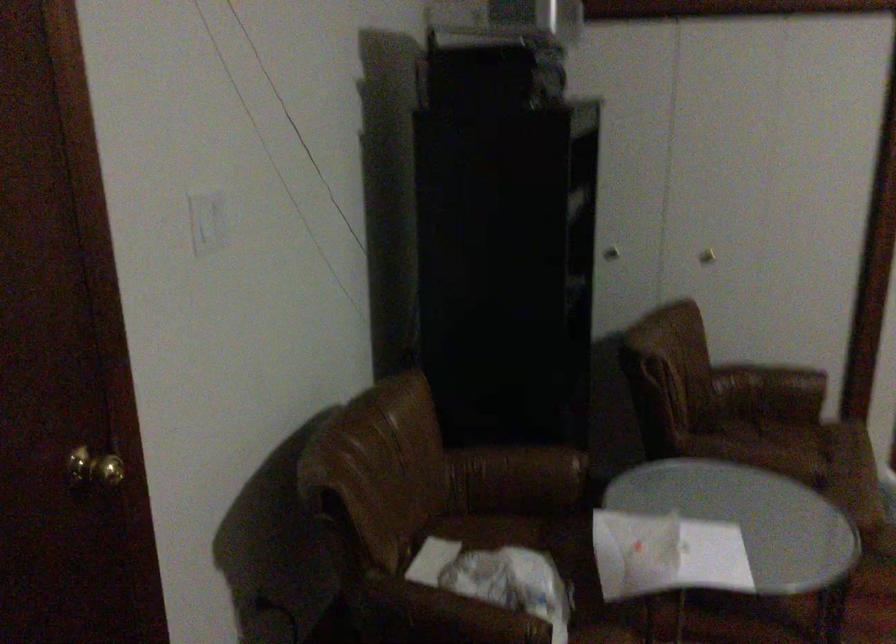
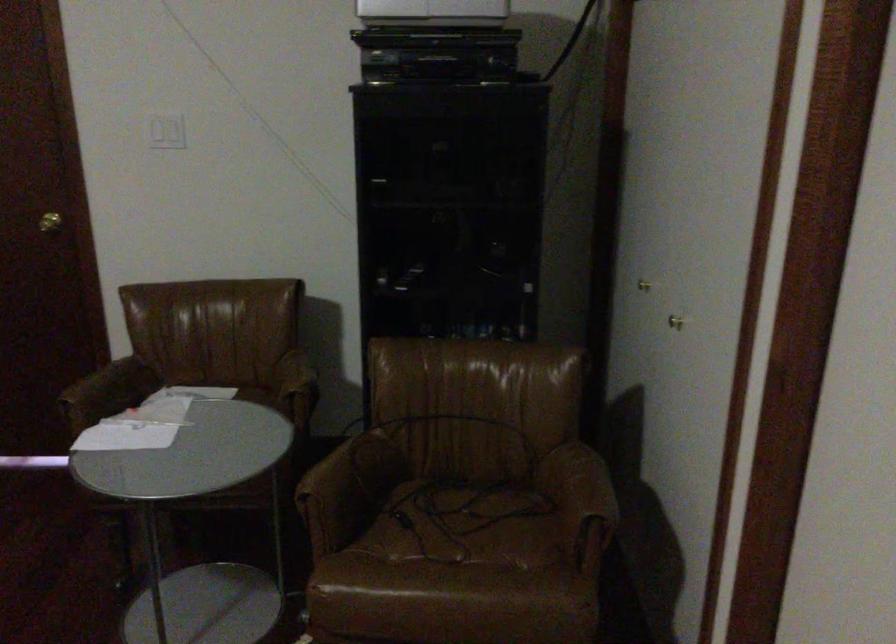
Where in the second image is the point corresponding to the point at 152,466 from the first image?

(49, 222)